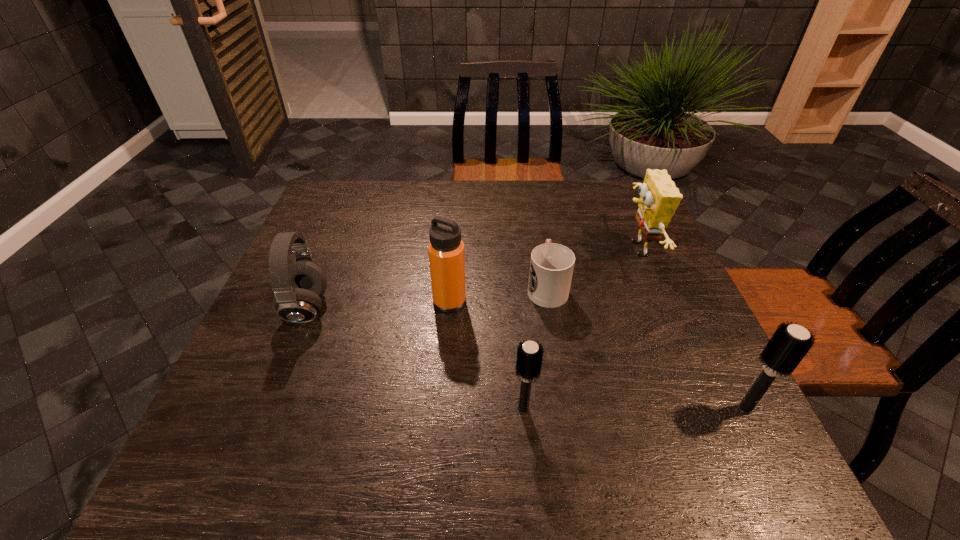
Identify the location of free region at the far right corner of the desktop. (624, 188).

This screenshot has width=960, height=540. Identify the location of vacant point at the near right corner. (721, 409).

Find the location of a particular element. The width and height of the screenshot is (960, 540). free space between the sponge and the leftmost object is located at coordinates (471, 279).

Find the location of a particular element. This screenshot has height=540, width=960. empty location between the third object from right to left and the rightmost object is located at coordinates (646, 348).

Where is `vacant area between the third object from right to left and the thermos bottle`? The height and width of the screenshot is (540, 960). vacant area between the third object from right to left and the thermos bottle is located at coordinates (498, 294).

The height and width of the screenshot is (540, 960). I want to click on vacant space that is in between the headset and the third object from right to left, so click(x=427, y=298).

Locate an element on the screen. free space between the cup and the right hairbrush is located at coordinates (646, 348).

Identify the location of vacant area that lies between the sponge and the rightmost object. (690, 329).

This screenshot has height=540, width=960. I want to click on empty location between the shortest object and the rightmost object, so click(x=646, y=348).

What are the coordinates of `the closest object to the taller hairbrush` in the screenshot? It's located at (659, 197).